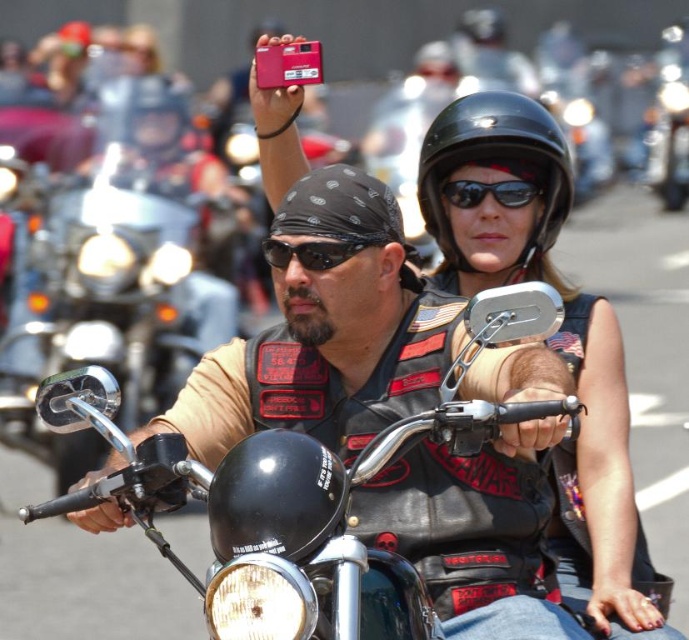
Question: Does matte black helmet at upper center have a lesser width compared to metallic silver motorcycle at center?

Choices:
 (A) yes
 (B) no

Answer: (B)

Question: Among these objects, which one is farthest from the camera?

Choices:
 (A) black glossy helmet at upper center
 (B) black leather vest at center
 (C) leather vest at center

Answer: (A)

Question: Which point is closer to the camera taking this photo?

Choices:
 (A) (566, 390)
 (B) (452, 202)
 (C) (615, 513)
 (D) (338, 259)

Answer: (A)

Question: Which point is closer to the camera?

Choices:
 (A) (531, 145)
 (B) (267, 248)
 (C) (449, 346)

Answer: (C)

Question: Can you confirm if polished chrome handlebars at center is positioned to the left of black matte sunglasses at upper center?

Choices:
 (A) yes
 (B) no

Answer: (A)

Question: Can you confirm if polished chrome handlebars at center is positioned to the left of matte black helmet at upper center?

Choices:
 (A) no
 (B) yes

Answer: (B)